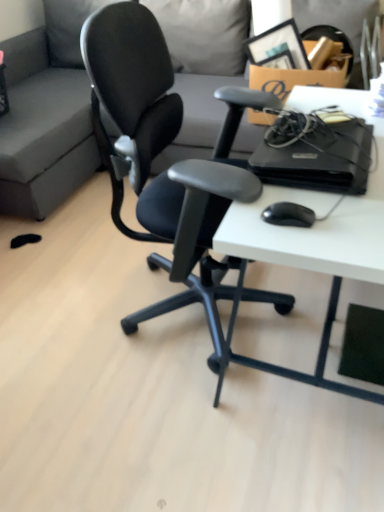
Locate an element on the screen. This screenshot has width=384, height=512. free space in front of black matte mouse at lower right is located at coordinates (312, 242).